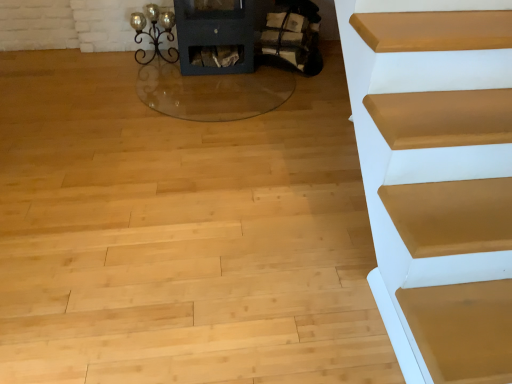
Question: Is wooden logs at center to the left or to the right of metallic wrought iron candle holder at upper left in the image?

Choices:
 (A) right
 (B) left

Answer: (A)

Question: Is wooden logs at center inside or outside of metallic wrought iron candle holder at upper left?

Choices:
 (A) inside
 (B) outside

Answer: (B)

Question: In terms of width, does wooden logs at center look wider or thinner when compared to metallic wrought iron candle holder at upper left?

Choices:
 (A) thin
 (B) wide

Answer: (B)

Question: Considering the positions of metallic wrought iron candle holder at upper left and wooden logs at center in the image, is metallic wrought iron candle holder at upper left bigger or smaller than wooden logs at center?

Choices:
 (A) big
 (B) small

Answer: (B)

Question: From a real-world perspective, relative to wooden logs at center, is metallic wrought iron candle holder at upper left vertically above or below?

Choices:
 (A) above
 (B) below

Answer: (B)

Question: From the image's perspective, is metallic wrought iron candle holder at upper left located above or below wooden logs at center?

Choices:
 (A) above
 (B) below

Answer: (B)

Question: Is metallic wrought iron candle holder at upper left situated inside wooden logs at center or outside?

Choices:
 (A) inside
 (B) outside

Answer: (B)